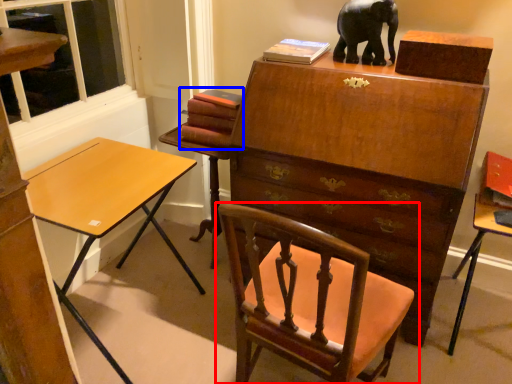
Question: Among these objects, which one is nearest to the camera, chair (highlighted by a red box) or book (highlighted by a blue box)?

Choices:
 (A) chair
 (B) book

Answer: (A)